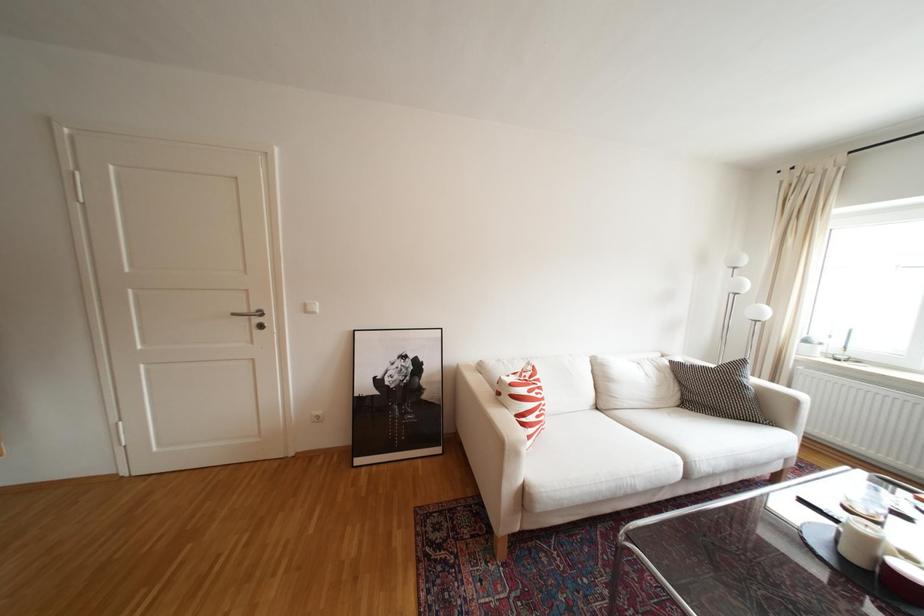
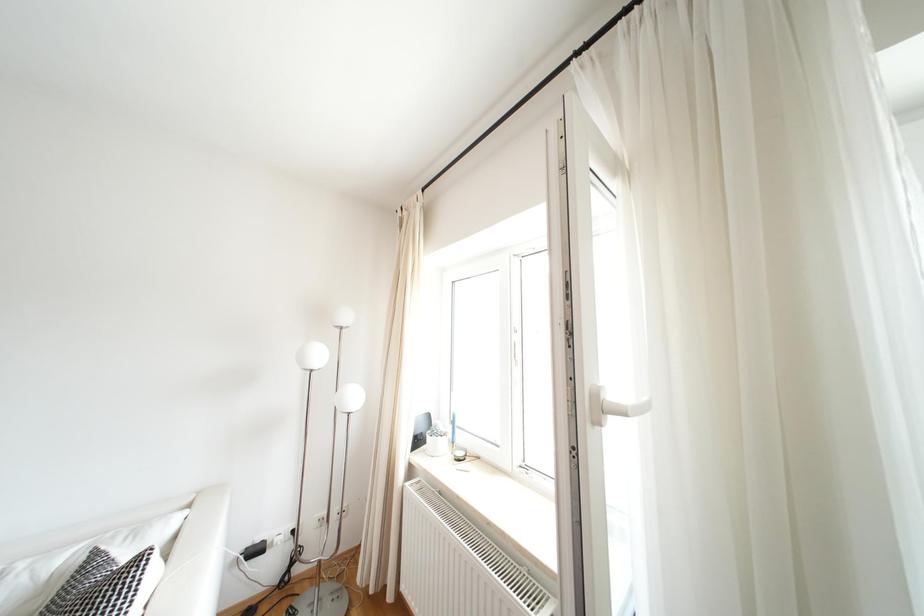
Question: The images are taken continuously from a first-person perspective. In which direction are you moving?

Choices:
 (A) Left
 (B) Right
 (C) Forward
 (D) Backward

Answer: (B)